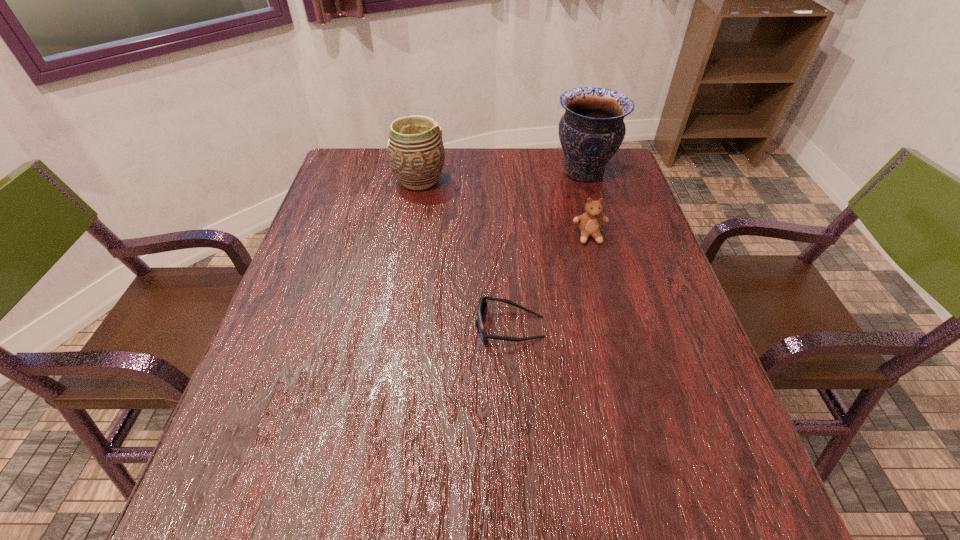
Locate an element on the screen. free space located on the front handle of the tallest object is located at coordinates (499, 172).

In order to click on vacant position located 0.390m on the right of the third shortest object in this screenshot , I will do `click(576, 180)`.

Where is `vacant space situated on the front-facing side of the third farthest object`? vacant space situated on the front-facing side of the third farthest object is located at coordinates (602, 282).

Identify the location of free space located on the front-facing side of the nearest object. (331, 327).

Identify the location of free point located on the front-facing side of the nearest object. This screenshot has height=540, width=960. (406, 327).

Where is `free location located 0.120m on the front-facing side of the nearest object`? Image resolution: width=960 pixels, height=540 pixels. free location located 0.120m on the front-facing side of the nearest object is located at coordinates (420, 327).

Where is `pottery located at the right edge`? pottery located at the right edge is located at coordinates (592, 129).

Image resolution: width=960 pixels, height=540 pixels. What are the coordinates of `teddy bear situated at the right edge` in the screenshot? It's located at [590, 222].

At what (x,y) coordinates should I click in order to perform the action: click on object present at the far right corner. Please return your answer as a coordinate pair (x, y). Looking at the image, I should click on (592, 129).

This screenshot has width=960, height=540. What are the coordinates of `blank space at the far edge of the desktop` in the screenshot? It's located at (552, 176).